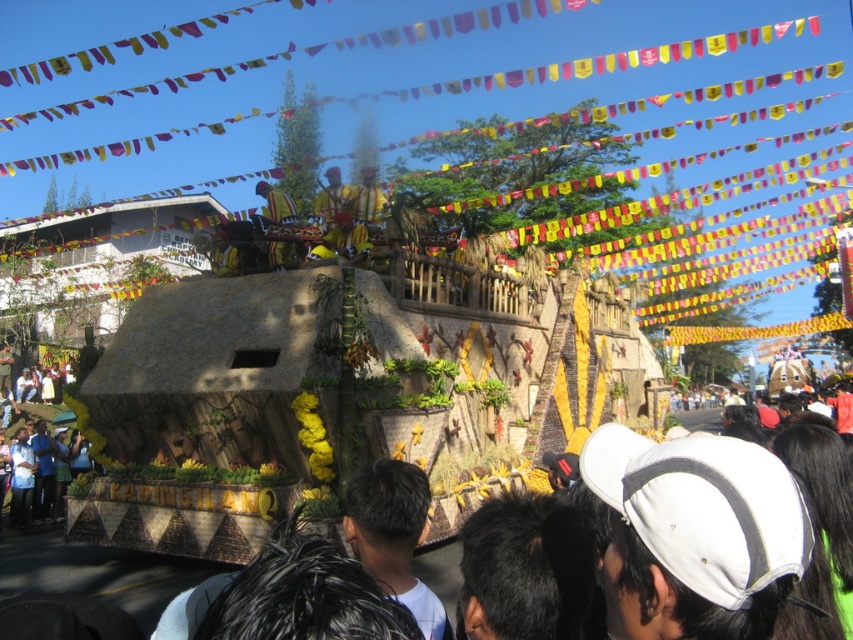
Question: Which of the following is the closest to the observer?

Choices:
 (A) wooden figure at center
 (B) black hair at center

Answer: (B)

Question: Is black hair at center bigger than wooden figure at center?

Choices:
 (A) no
 (B) yes

Answer: (A)

Question: Can you confirm if black hair at center is smaller than wooden figure at center?

Choices:
 (A) no
 (B) yes

Answer: (B)

Question: Can you confirm if black hair at center is positioned above wooden figure at center?

Choices:
 (A) yes
 (B) no

Answer: (B)